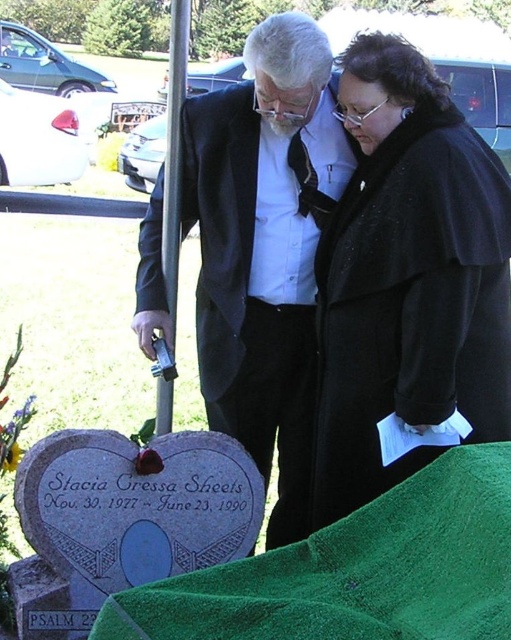
You are a photographer trying to capture a closeup of the gravestone. The black wool coat at center and the green fabric at lower center are in the frame. Which object is wider in the photo?

The green fabric at lower center is wider than the black wool coat at center.

You are a photographer at the scene and need to capture both the black wool coat at center and the matte black suit at center in the same frame. Which object should you position to the left in your camera viewfinder to ensure both are visible?

You should position the matte black suit at center to the left in your camera viewfinder since the black wool coat at center is on its right side, ensuring both are included in the frame.